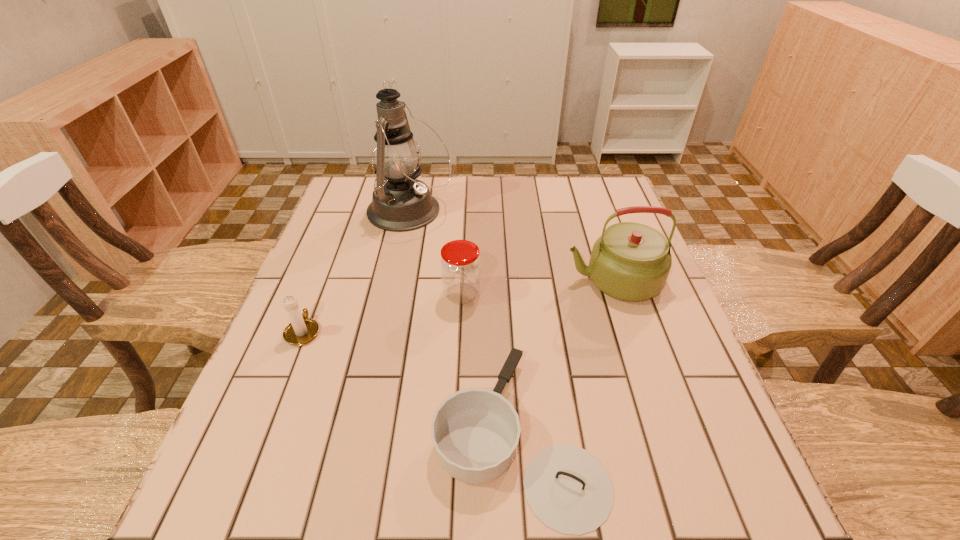
Where is `candle holder present at the left edge`? The image size is (960, 540). candle holder present at the left edge is located at coordinates (302, 330).

Locate an element on the screen. This screenshot has width=960, height=540. object that is positioned at the right edge is located at coordinates (631, 261).

The height and width of the screenshot is (540, 960). What are the coordinates of `object that is at the far left corner` in the screenshot? It's located at (400, 202).

The width and height of the screenshot is (960, 540). In the image, there is a desktop. Identify the location of vacant region at the near edge. (434, 500).

This screenshot has width=960, height=540. Identify the location of free location at the left edge. pyautogui.click(x=272, y=350).

Locate an element on the screen. The height and width of the screenshot is (540, 960). vacant area at the right edge is located at coordinates (713, 396).

Find the location of `vacant space at the far left corner of the desktop`. vacant space at the far left corner of the desktop is located at coordinates (346, 184).

What are the coordinates of `free space that is in between the second shortest object and the fourth shortest object` in the screenshot? It's located at (458, 306).

Locate an element on the screen. The height and width of the screenshot is (540, 960). empty space that is in between the oil lamp and the fourth shortest object is located at coordinates (512, 246).

At what (x,y) coordinates should I click in order to perform the action: click on vacant point located between the tallest object and the kettle. Please return your answer as a coordinate pair (x, y). The image size is (960, 540). Looking at the image, I should click on (512, 246).